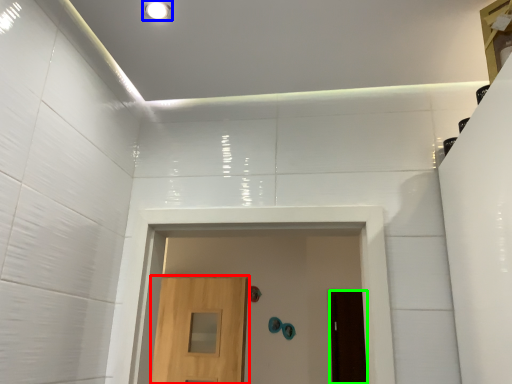
Question: Based on their relative distances, which object is farther from door (highlighted by a red box)? Choose from lighting (highlighted by a blue box) and door (highlighted by a green box).

Choices:
 (A) lighting
 (B) door

Answer: (A)